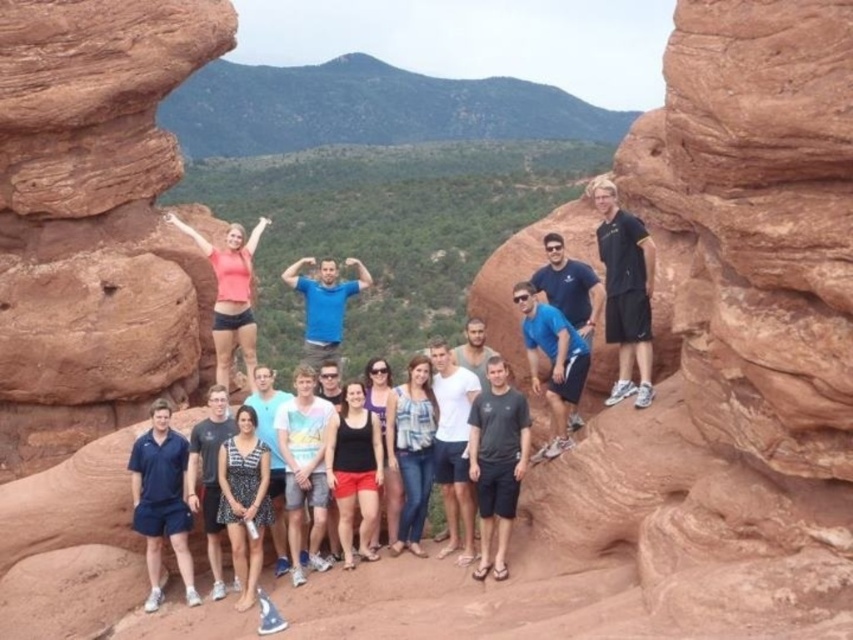
Question: Does light blue t-shirt at center have a greater width compared to white cotton shirt at center?

Choices:
 (A) no
 (B) yes

Answer: (B)

Question: Does black matte tank top at center appear over white cotton shirt at center?

Choices:
 (A) yes
 (B) no

Answer: (A)

Question: Considering the real-world distances, which object is farthest from the black dotted dress at lower center?

Choices:
 (A) matte pink tank top at upper left
 (B) blue fabric shorts at lower left

Answer: (A)

Question: Which of the following is the closest to the observer?

Choices:
 (A) smooth sandstone rock at upper left
 (B) reddish-brown sandstone at center-right
 (C) dark gray t-shirt at center

Answer: (B)

Question: Which point appears closest to the camera in this image?

Choices:
 (A) (224, 589)
 (B) (486, 545)

Answer: (B)

Question: Is reddish-brown sandstone at center-right to the left of matte pink tank top at upper left from the viewer's perspective?

Choices:
 (A) no
 (B) yes

Answer: (A)